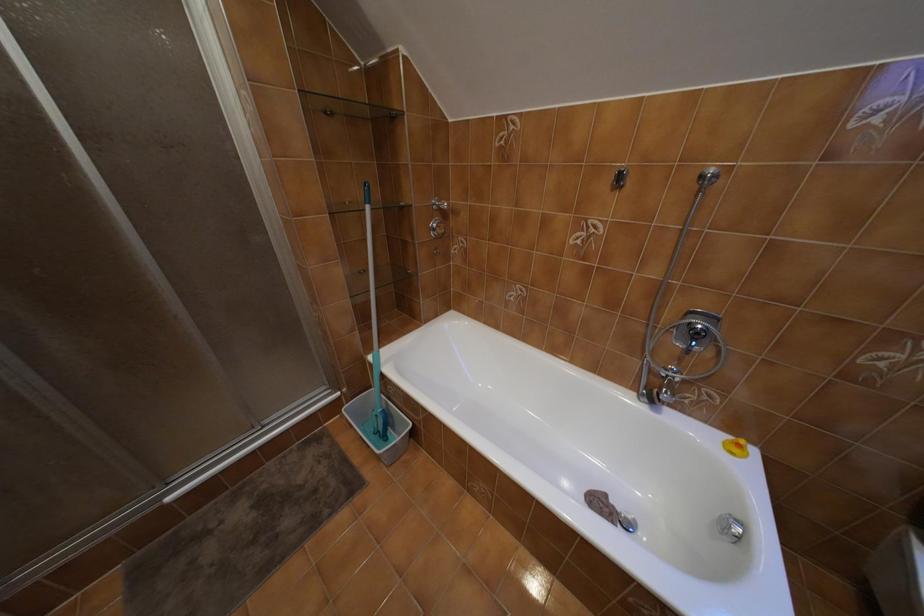
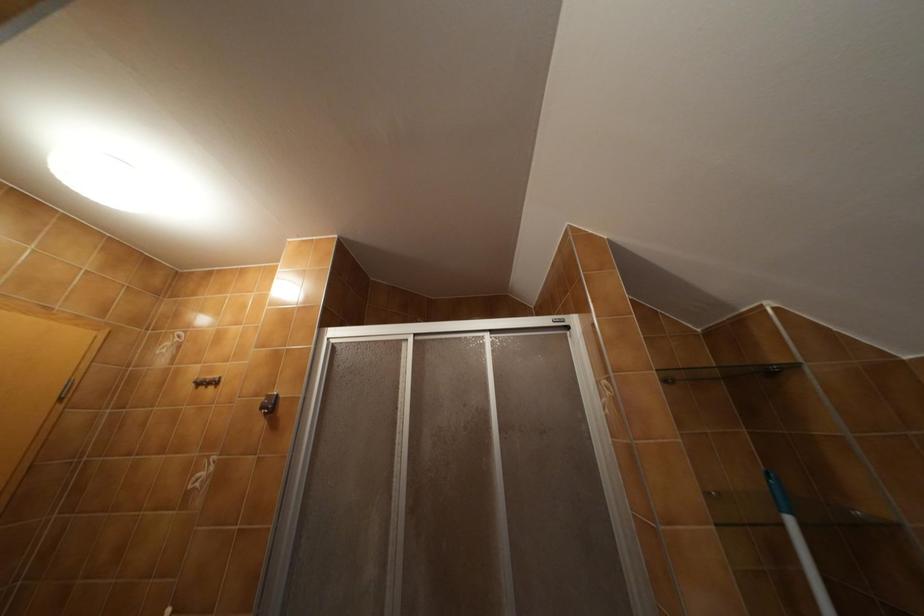
The images are taken continuously from a first-person perspective. In which direction is your viewpoint rotating?

The camera's rotation is toward left-up.